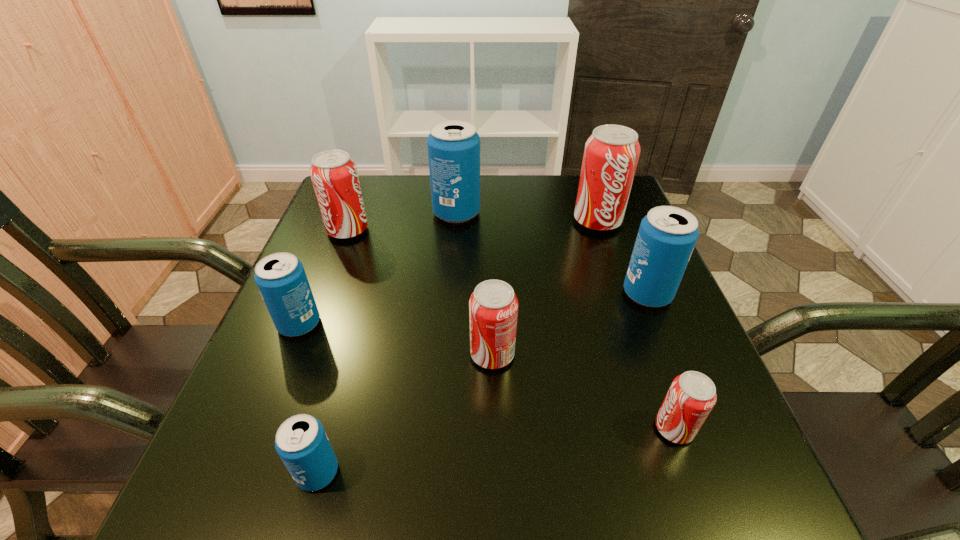
You are a GUI agent. You are given a task and a screenshot of the screen. Output one action in this format:
    pyautogui.click(x=<x>, y=<y>)
    Task: Click on the unoccupied area between the third farthest red soda can and the leftmost red soda can
    Image resolution: width=960 pixels, height=540 pixels.
    Given the screenshot: What is the action you would take?
    pyautogui.click(x=420, y=292)

Locate an element on the screen. unoccupied position between the biggest red soda can and the biggest blue soda can is located at coordinates (527, 217).

Point out which object is positioned as the fourth nearest to the biggest red soda can. Please provide its 2D coordinates. Your answer should be formatted as a tuple, i.e. [(x, y)], where the tuple contains the x and y coordinates of a point satisfying the conditions above.

[(692, 395)]

Find the location of a particular element. object that is the fifth closest to the nearest object is located at coordinates (667, 235).

Identify the location of the second closest soda can to the leftmost red soda can. (280, 277).

The width and height of the screenshot is (960, 540). Find the location of `soda can that is the seventh nearest to the third biggest blue soda can`. soda can that is the seventh nearest to the third biggest blue soda can is located at coordinates (667, 235).

Choose which blue soda can is the second nearest neighbor to the rightmost blue soda can. Please provide its 2D coordinates. Your answer should be formatted as a tuple, i.e. [(x, y)], where the tuple contains the x and y coordinates of a point satisfying the conditions above.

[(301, 442)]

Where is `the third closest blue soda can to the second nearest object`? the third closest blue soda can to the second nearest object is located at coordinates (453, 146).

Choose which red soda can is the third nearest neighbor to the biggest blue soda can. Please provide its 2D coordinates. Your answer should be formatted as a tuple, i.e. [(x, y)], where the tuple contains the x and y coordinates of a point satisfying the conditions above.

[(493, 306)]

Where is `red soda can that is the nearest to the third blue soda can from left to right`? red soda can that is the nearest to the third blue soda can from left to right is located at coordinates (334, 175).